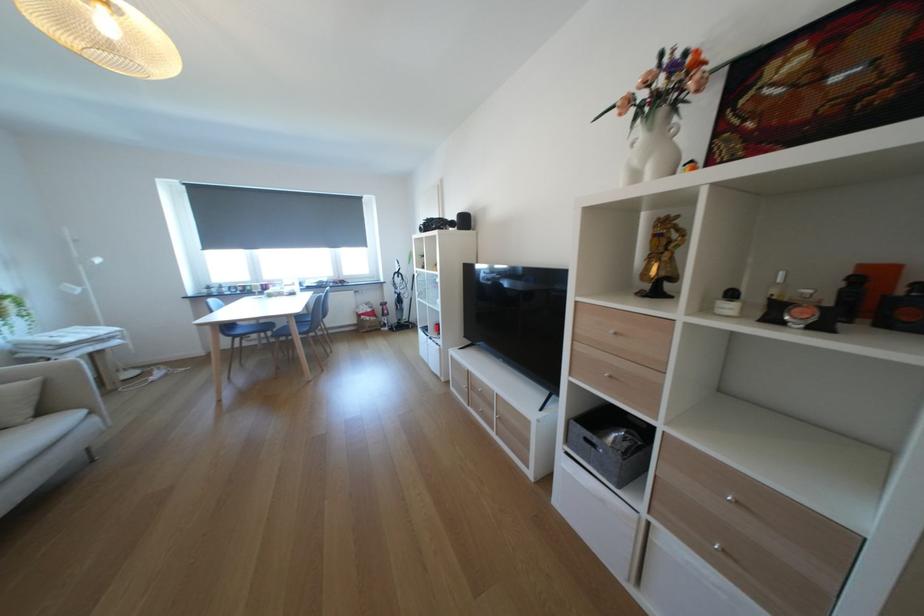
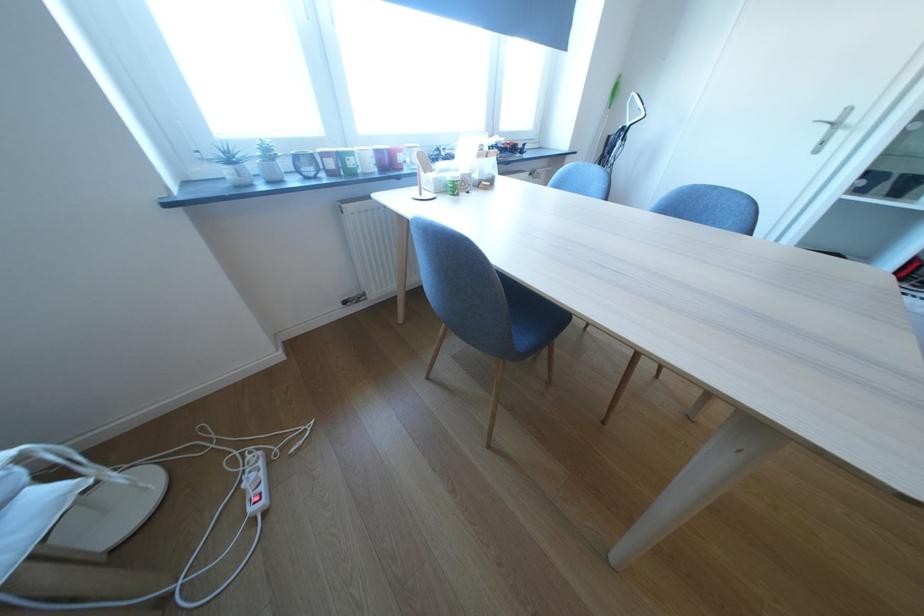
In the second image, find the point that corresponds to point 276,286 in the first image.

(399, 151)